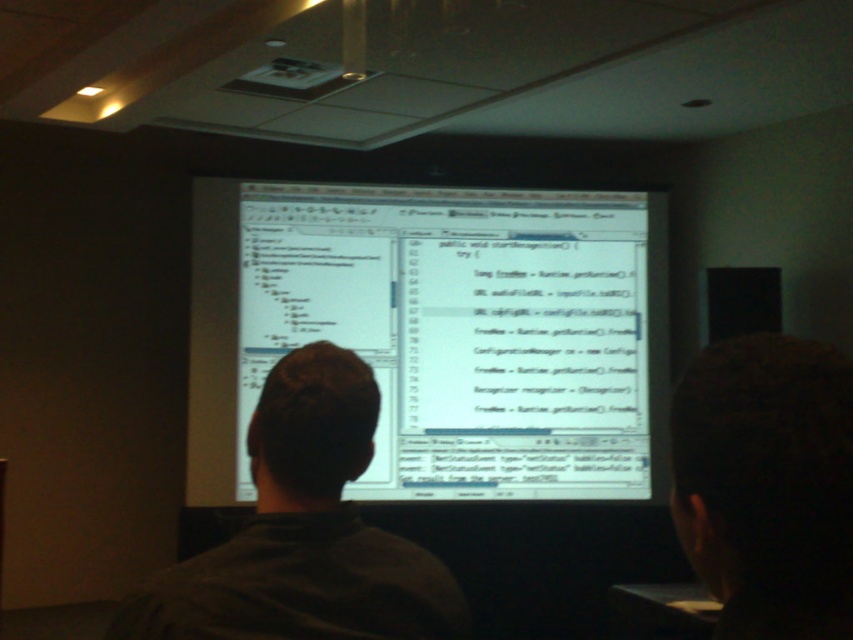
You are a technician trying to determine if the white glossy computer monitor at center can be placed on a desk that is the same width as the dark gray shirt at center. Based on the scene, will the monitor fit on the desk?

The white glossy computer monitor at center is wider than the dark gray shirt at center. Since the desk has the same width as the shirt, the monitor will not fit on the desk.

You are a technician who needs to determine if the white glossy computer monitor at center can be placed on a desk that can only accommodate items smaller than the dark gray shirt at center. Based on the scene description, can the monitor fit on the desk?

The white glossy computer monitor at center is larger in size than the dark gray shirt at center. Since the desk can only accommodate items smaller than the shirt, the monitor cannot fit on the desk.

You are a guest speaker in a tech conference room. You need to adjust the position of the white glossy computer monitor at center and the dark gray shirt at center so that the shirt is now to the right of the monitor. Is this possible without moving the monitor?

The white glossy computer monitor at center is currently to the right of the dark gray shirt at center. To have the dark gray shirt at center to the right of the monitor, you would need to move the shirt to the right side of the monitor. Since the question specifies not moving the monitor, moving the shirt to the right of the monitor is possible if there is enough space in the room. However, based on the provided information, we cannot confirm the availability of space. The answer depends on the room layout